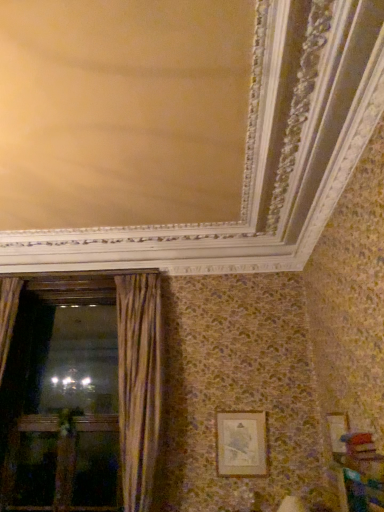
Measure the distance between point (x=126, y=478) and camera.

The distance of point (x=126, y=478) from camera is 3.46 meters.

Identify the location of wooden cabinet at lower right. (360, 481).

Is wooden screen door at left facing towards wooden cabinet at lower right?

No, wooden screen door at left is not facing towards wooden cabinet at lower right.

Which is closer, [10,484] or [374,489]?

Point [10,484] is positioned farther from the camera compared to point [374,489].

From a real-world perspective, is wooden screen door at left positioned over wooden cabinet at lower right based on gravity?

No, from a real-world perspective, wooden screen door at left is not over wooden cabinet at lower right

Which of these two, wooden screen door at left or wooden cabinet at lower right, is thinner?

Thinner between the two is wooden screen door at left.

Is the depth of gold textured frame at lower right less than that of gold textured curtain at left?

That is False.

Could you tell me if gold textured frame at lower right is facing gold textured curtain at left?

No.

Based on the photo, is gold textured frame at lower right spatially inside gold textured curtain at left, or outside of it?

gold textured frame at lower right is located beyond the bounds of gold textured curtain at left.

Does wooden screen door at left come behind gold textured frame at lower right?

Yes, it is.

Considering the relative sizes of wooden screen door at left and gold textured frame at lower right in the image provided, is wooden screen door at left shorter than gold textured frame at lower right?

No, wooden screen door at left is not shorter than gold textured frame at lower right.

Would you consider wooden screen door at left to be distant from gold textured frame at lower right?

That's right, there is a large distance between wooden screen door at left and gold textured frame at lower right.

Looking at this image, can you confirm if gold textured frame at lower right is positioned to the right of wooden screen door at left?

Yes.

Considering the sizes of gold textured frame at lower right and wooden screen door at left in the image, is gold textured frame at lower right wider or thinner than wooden screen door at left?

Clearly, gold textured frame at lower right has less width compared to wooden screen door at left.

Is wooden screen door at left inside gold textured frame at lower right?

Actually, wooden screen door at left is outside gold textured frame at lower right.

How different are the orientations of gold textured frame at lower right and wooden screen door at left in degrees?

The facing directions of gold textured frame at lower right and wooden screen door at left are 0.246 degrees apart.

From the image's perspective, is wooden cabinet at lower right positioned above or below wooden screen door at left?

Based on their image positions, wooden cabinet at lower right is located above wooden screen door at left.

From the picture: Are wooden cabinet at lower right and wooden screen door at left located far from each other?

Yes, wooden cabinet at lower right is far from wooden screen door at left.

From a real-world perspective, is wooden cabinet at lower right physically located above or below wooden screen door at left?

In terms of real-world spatial position, wooden cabinet at lower right is above wooden screen door at left.

Which object is further away from the camera taking this photo, gold textured curtain at left or wooden screen door at left?

wooden screen door at left is further away from the camera.

Could you tell me if gold textured curtain at left is turned towards wooden screen door at left?

No, gold textured curtain at left is not oriented towards wooden screen door at left.

Is point (139, 452) less distant than point (105, 437)?

Yes, point (139, 452) is in front of point (105, 437).

Between gold textured curtain at left and wooden screen door at left, which one appears on the right side from the viewer's perspective?

gold textured curtain at left is more to the right.

The height and width of the screenshot is (512, 384). I want to click on screen door below the gold textured curtain at left (from the image's perspective), so click(63, 465).

Looking at this image, based on their sizes in the image, would you say wooden screen door at left is bigger or smaller than gold textured curtain at left?

Clearly, wooden screen door at left is smaller in size than gold textured curtain at left.

Does wooden screen door at left lie in front of gold textured curtain at left?

No, wooden screen door at left is further to the viewer.

How far apart are wooden screen door at left and gold textured curtain at left?

wooden screen door at left and gold textured curtain at left are 89.55 centimeters apart from each other.

You are a GUI agent. You are given a task and a screenshot of the screen. Output one action in this format:
    pyautogui.click(x=<x>, y=<y>)
    Task: Click on the furniture located above the wooden screen door at left (from a real-world perspective)
    The height and width of the screenshot is (512, 384).
    Given the screenshot: What is the action you would take?
    pyautogui.click(x=360, y=481)

Identify the location of picture frame that is under the gold textured curtain at left (from a real-world perspective). (241, 444).

When comparing their distances from gold textured curtain at left, does gold textured frame at lower right or wooden screen door at left seem closer?

gold textured frame at lower right is closer to gold textured curtain at left.

Which object lies further to the anchor point gold textured frame at lower right, gold textured curtain at left or wooden screen door at left?

wooden screen door at left is further to gold textured frame at lower right.

When comparing their distances from gold textured frame at lower right, does wooden cabinet at lower right or wooden screen door at left seem closer?

Based on the image, wooden screen door at left appears to be nearer to gold textured frame at lower right.

Consider the image. Estimate the real-world distances between objects in this image. Which object is closer to gold textured frame at lower right, wooden screen door at left or gold textured curtain at left?

gold textured curtain at left.

Looking at the image, which one is located further to gold textured frame at lower right, wooden cabinet at lower right or gold textured curtain at left?

wooden cabinet at lower right.

Estimate the real-world distances between objects in this image. Which object is further from wooden cabinet at lower right, gold textured curtain at left or wooden screen door at left?

The object further to wooden cabinet at lower right is wooden screen door at left.

Estimate the real-world distances between objects in this image. Which object is further from wooden cabinet at lower right, gold textured frame at lower right or wooden screen door at left?

Based on the image, wooden screen door at left appears to be further to wooden cabinet at lower right.

Considering their positions, is wooden cabinet at lower right positioned closer to gold textured curtain at left than gold textured frame at lower right?

The object closer to gold textured curtain at left is gold textured frame at lower right.

In order to click on curtain between wooden screen door at left and wooden cabinet at lower right from left to right in this screenshot , I will do `click(139, 384)`.

Find the location of a particular element. This screenshot has width=384, height=512. curtain positioned between wooden cabinet at lower right and gold textured frame at lower right from near to far is located at coordinates (139, 384).

You are a GUI agent. You are given a task and a screenshot of the screen. Output one action in this format:
    pyautogui.click(x=<x>, y=<y>)
    Task: Click on the curtain between wooden screen door at left and gold textured frame at lower right
    
    Given the screenshot: What is the action you would take?
    pyautogui.click(x=139, y=384)

You are a GUI agent. You are given a task and a screenshot of the screen. Output one action in this format:
    pyautogui.click(x=<x>, y=<y>)
    Task: Click on the picture frame between wooden screen door at left and wooden cabinet at lower right from left to right
    
    Given the screenshot: What is the action you would take?
    tap(241, 444)